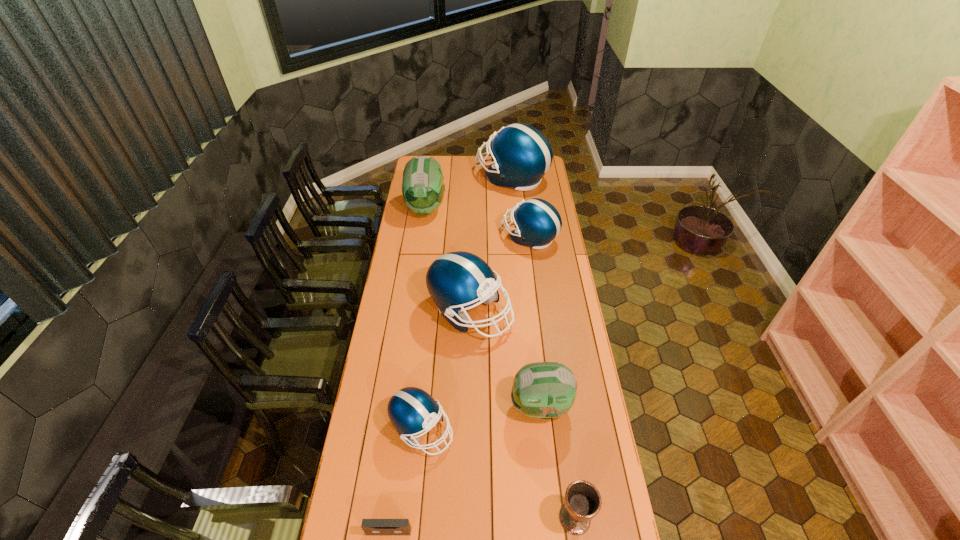
I want to click on free space located at the front of the third biggest blue football helmet with the faceguard, so click(x=466, y=237).

At what (x,y) coordinates should I click in order to perform the action: click on blank area located on the visor of the right green football helmet. Please return your answer as a coordinate pair (x, y). Image resolution: width=960 pixels, height=540 pixels. Looking at the image, I should click on (480, 407).

Where is `vacant space located on the visor of the right green football helmet`? vacant space located on the visor of the right green football helmet is located at coordinates (466, 407).

This screenshot has width=960, height=540. I want to click on vacant space located 0.200m on the visor of the right green football helmet, so click(x=455, y=407).

At what (x,y) coordinates should I click in order to perform the action: click on vacant space located 0.080m at the front of the smallest blue football helmet with the faceguard. Please return your answer as a coordinate pair (x, y). The width and height of the screenshot is (960, 540). Looking at the image, I should click on (476, 429).

Where is `vacant space located on the back of the chalice`? This screenshot has width=960, height=540. vacant space located on the back of the chalice is located at coordinates (567, 462).

Where is `object situated at the far edge`? The height and width of the screenshot is (540, 960). object situated at the far edge is located at coordinates (521, 155).

In order to click on videotape present at the left edge in this screenshot , I will do `click(370, 526)`.

You are a GUI agent. You are given a task and a screenshot of the screen. Output one action in this format:
    pyautogui.click(x=<x>, y=<y>)
    Task: Click on the chalice that is at the right edge
    This screenshot has height=540, width=960.
    Given the screenshot: What is the action you would take?
    pyautogui.click(x=583, y=501)

What are the coordinates of `object present at the far right corner` in the screenshot? It's located at (521, 155).